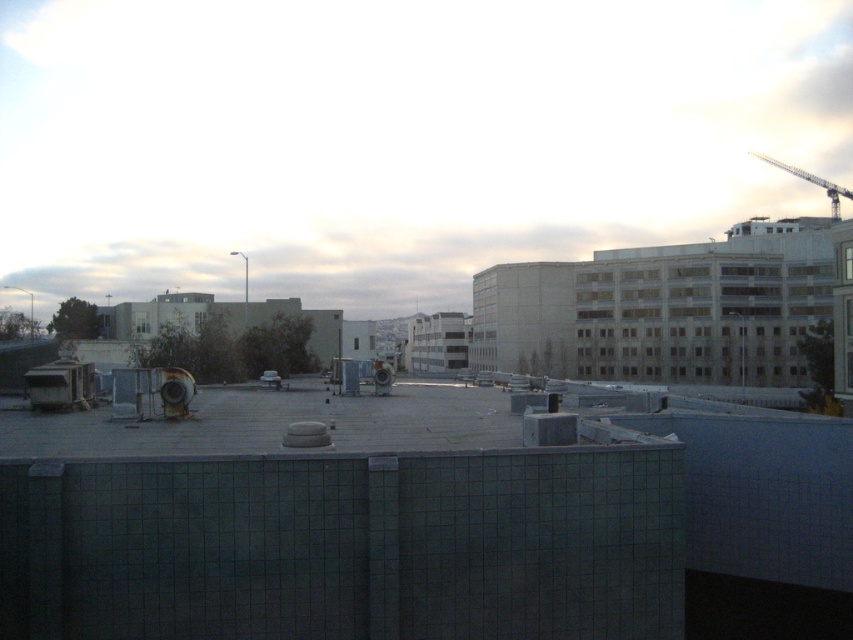
Question: Does gray concrete wall at center appear over metallic gray crane at upper right?

Choices:
 (A) yes
 (B) no

Answer: (B)

Question: Which object appears closest to the camera in this image?

Choices:
 (A) gray concrete wall at center
 (B) metallic gray crane at upper right

Answer: (A)

Question: Does gray concrete wall at center come behind metallic gray crane at upper right?

Choices:
 (A) no
 (B) yes

Answer: (A)

Question: Which of the following is the farthest from the observer?

Choices:
 (A) (675, 408)
 (B) (830, 216)

Answer: (B)

Question: Which point appears closest to the camera in this image?

Choices:
 (A) (828, 465)
 (B) (840, 188)

Answer: (A)

Question: Can you confirm if gray concrete wall at center is smaller than metallic gray crane at upper right?

Choices:
 (A) no
 (B) yes

Answer: (B)